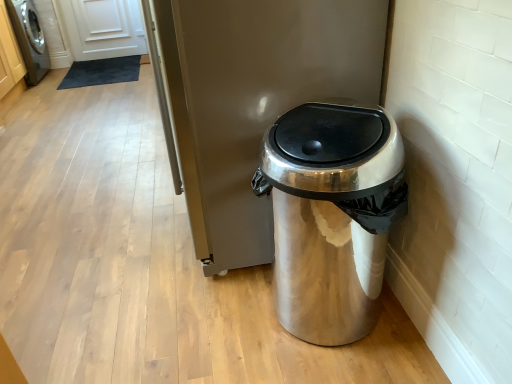
This screenshot has height=384, width=512. Find the location of `vacant area that lies between satin silver trash can at center and shiny metallic trash can at lower right`. vacant area that lies between satin silver trash can at center and shiny metallic trash can at lower right is located at coordinates (234, 308).